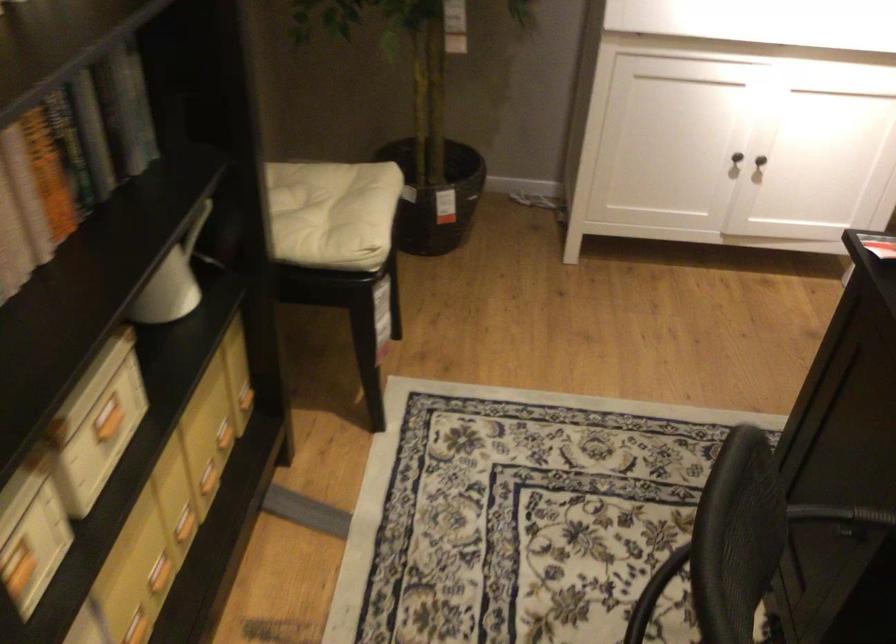
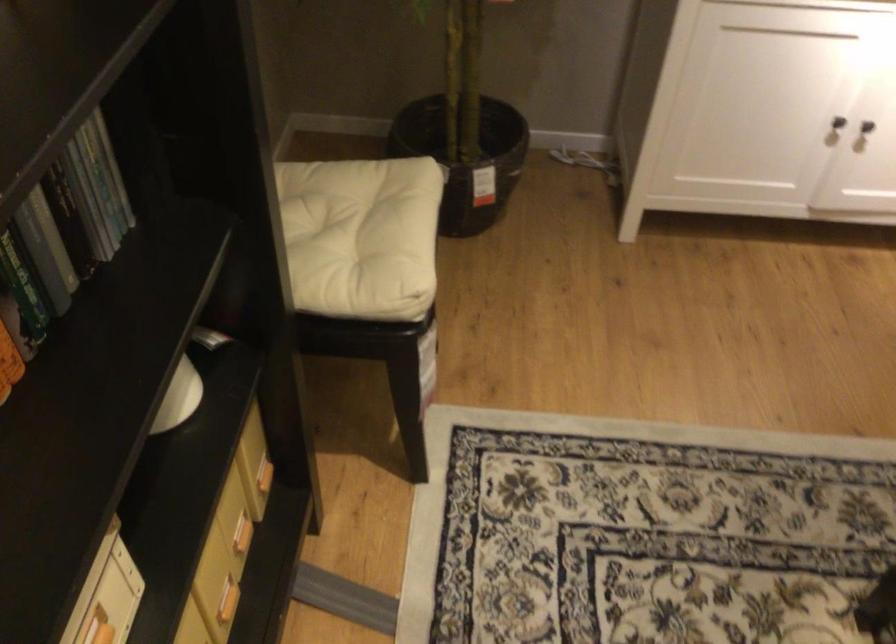
Find the pixel in the second image that matches pixel 220 435 in the first image.

(240, 534)